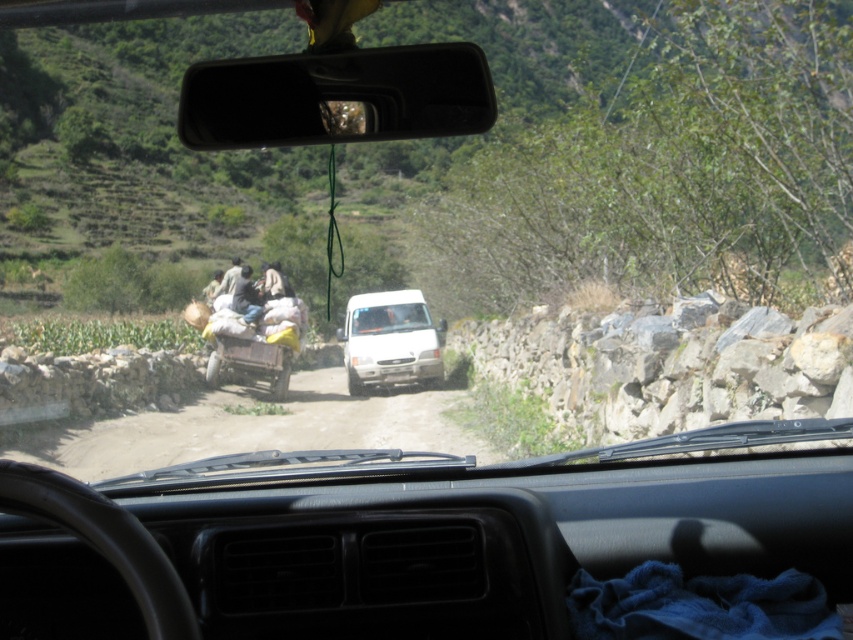
You are a passenger in the car and you see the point at coordinates [335,97]. Where is this point located?

The point at coordinates [335,97] is located on the black plastic view mirror at center.

You are a passenger in the car and notice two items at the center of the scene. One is the dusty gravel road at center and the other is the dark gray fabric bag at center. Which one is closer to you?

The dark gray fabric bag at center is closer because it is above the dusty gravel road at center, which is positioned under it.

You are a passenger in the car and want to check the road ahead. Which object, the black plastic view mirror at center or the dusty gravel road at center, would allow you to see the road ahead more clearly?

The black plastic view mirror at center has a greater height compared to the dusty gravel road at center, so it is positioned higher up. This allows the mirror to reflect the road ahead more clearly than the road itself, which is lower and possibly obstructed by the vehicle or terrain.